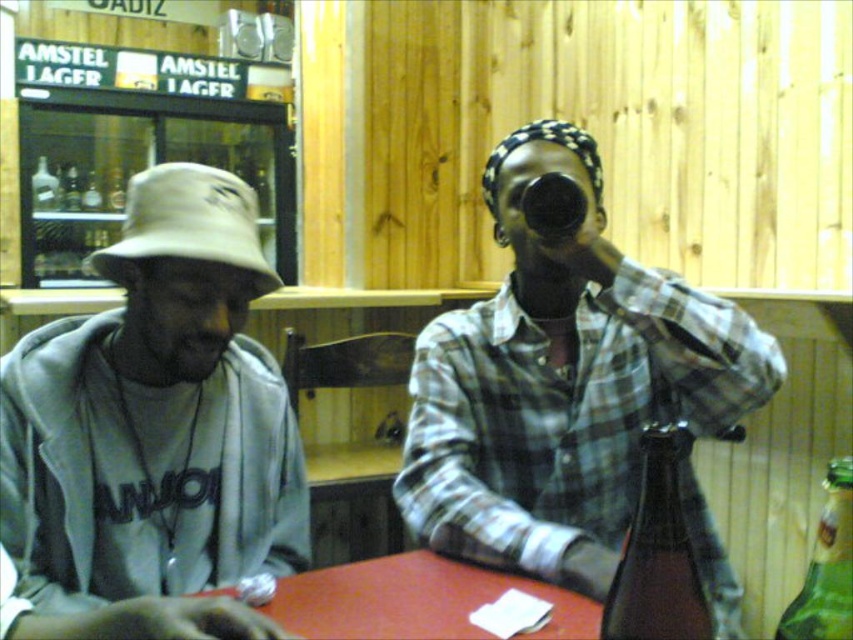
Question: Estimate the real-world distances between objects in this image. Which object is closer to the gray cotton hoodie at left?

Choices:
 (A) green glass bottle at right
 (B) smooth red table at center

Answer: (B)

Question: Does brown glass bottle at lower right appear on the left side of white fabric hat at left?

Choices:
 (A) no
 (B) yes

Answer: (A)

Question: Which is farther from the gray cotton hoodie at left?

Choices:
 (A) white fabric hat at left
 (B) black plastic cup at upper center
 (C) plaid shirt at center
 (D) smooth red table at center

Answer: (B)

Question: Considering the real-world distances, which object is closest to the gray cotton hoodie at left?

Choices:
 (A) smooth red table at center
 (B) brown glass bottle at lower right

Answer: (A)

Question: In this image, where is gray cotton hoodie at left located relative to black plastic cup at upper center?

Choices:
 (A) left
 (B) right

Answer: (A)

Question: Is plaid shirt at center thinner than smooth red table at center?

Choices:
 (A) yes
 (B) no

Answer: (B)